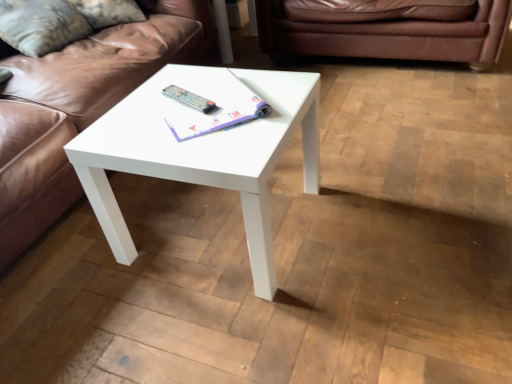
Find the location of a particular element. Image resolution: width=512 pixels, height=384 pixels. vacant area on top of white glossy coffee table at center (from a real-world perspective) is located at coordinates (197, 110).